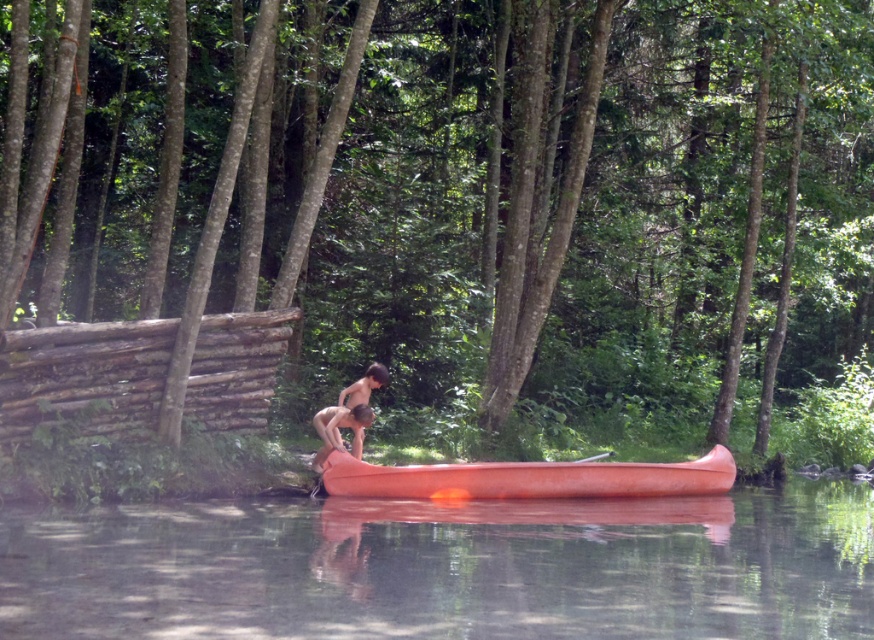
Consider the image. You are planning to store both the orange smooth canoe at center and the smooth orange canoe at center in a storage shed. Which one requires more space due to its size?

The orange smooth canoe at center requires more space because it is larger in size than the smooth orange canoe at center.

You are planning to store an orange smooth canoe at center and a smooth orange canoe at center in a storage facility. The storage facility has a width restriction of 1.2 meters. Which of the two canoes will not fit if their widths are as described?

The orange smooth canoe at center has a greater width than the smooth orange canoe at center. Since the storage facility has a width restriction of 1.2 meters, the orange smooth canoe at center might exceed the limit and not fit, while the smooth orange canoe at center could fit if its width is under 1.2 meters.

You are a swimmer standing on the dock and see the transparent water at lower center and the smooth skin person at center. Which object is closer to you?

The smooth skin person at center is closer to you because the transparent water at lower center is positioned under them, indicating the person is above the water.